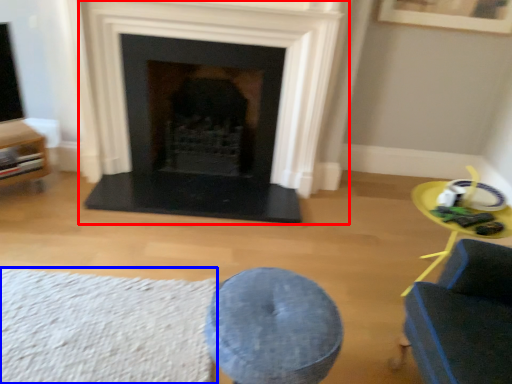
Question: Among these objects, which one is farthest to the camera, fireplace (highlighted by a red box) or plain (highlighted by a blue box)?

Choices:
 (A) fireplace
 (B) plain

Answer: (A)